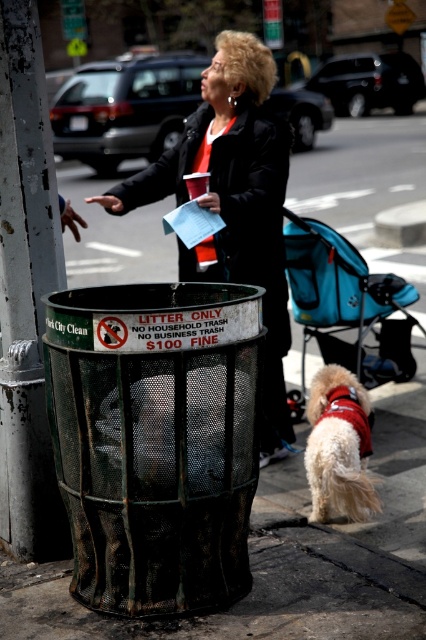
You are a delivery person trying to navigate through the street scene. You need to pass between the black leather jacket at center and the fluffy white dog at lower right. Can you fit through the space between them if your delivery cart is 1.2 meters wide?

The black leather jacket at center is wider than the fluffy white dog at lower right. However, the question is about the space between them, not their individual widths. Since the description only provides information about their widths and not the distance between them, we cannot determine if the 1.2 meter delivery cart can fit through the space. Additional information about the distance separating the two objects is needed to answer this question accurately.

You are a delivery person who needs to park your bike between the green painted metal pole at left and the blue fabric stroller at center. Is there enough space for your bike?

The green painted metal pole at left is in front of the blue fabric stroller at center, so there is no space between them for the bike to park.

You are a delivery person who needs to place a package between the black leather jacket at center and the fluffy white dog at lower right. The package requires a minimum of 1.5 meters of space to be placed safely. Is there enough space between them?

The black leather jacket at center is 1.04 meters away from the fluffy white dog at lower right, which is less than the required 1.5 meters. Therefore, there isn not enough space to safely place the package between them.